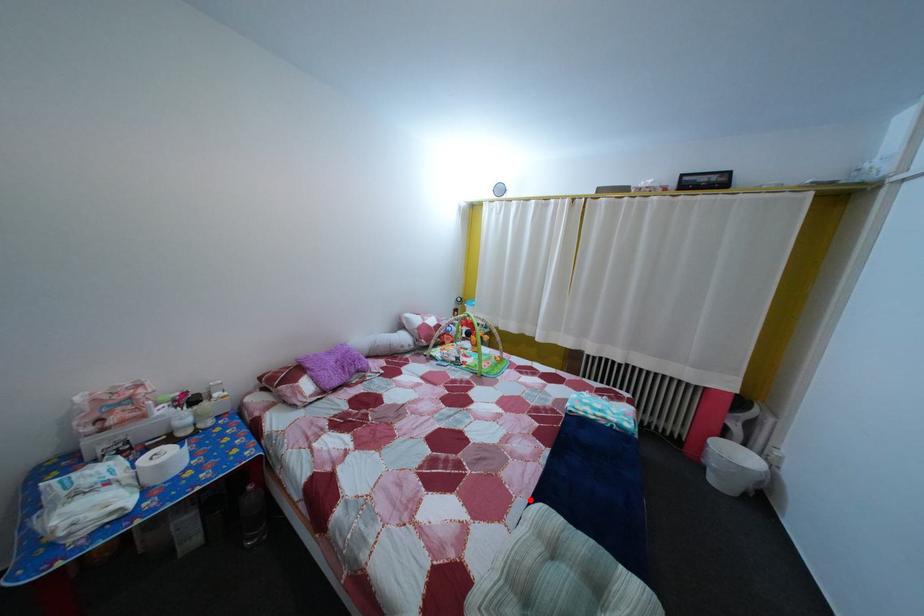
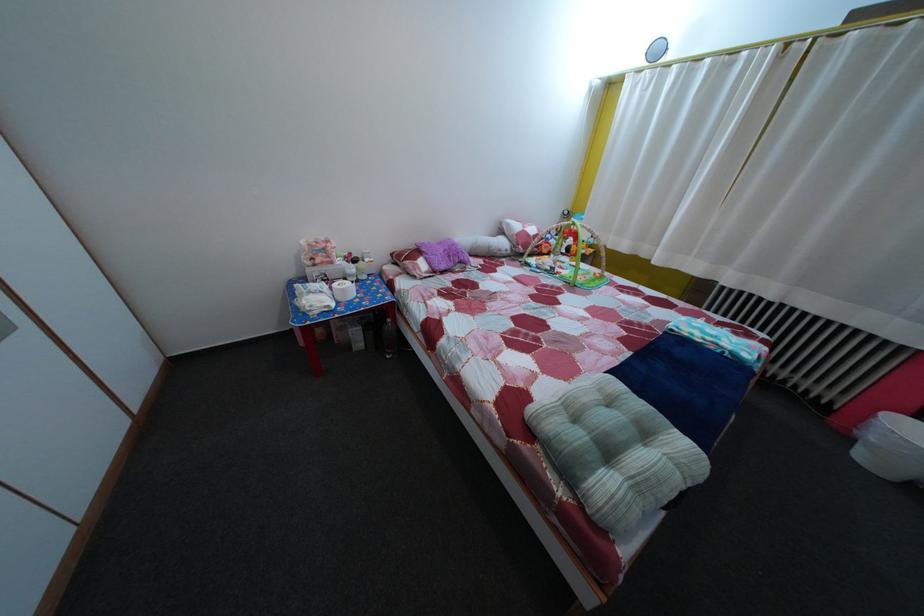
Question: I am providing you with two images of the same scene from different viewpoints. A red point is marked on the first image. Is the red point's position out of view in image 2?

Choices:
 (A) Yes
 (B) No

Answer: (B)